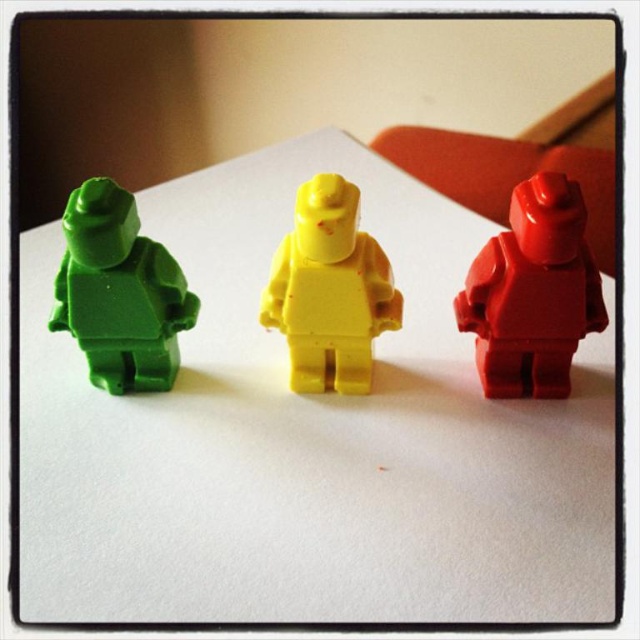
You are trying to fit both the matte green plastic figure at left and the yellow matte plastic minifigure at center into a narrow storage box. Based on their widths, which one might have difficulty fitting if the box has limited space?

The yellow matte plastic minifigure at center has a greater width than the matte green plastic figure at left, so it might have difficulty fitting into the narrow storage box.

Based on the photo, you are organizing a toy shelf and need to place the matte green plastic figure at left and the yellow matte plastic minifigure at center in a row from left to right. Based on their current positions, which figure should come first in the row?

The matte green plastic figure at left should come first in the row since it is already positioned on the left side of the yellow matte plastic minifigure at center.